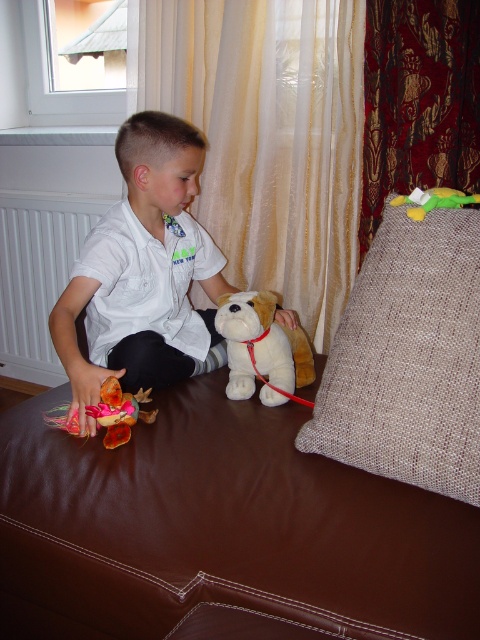
Question: Can you confirm if brown leather couch at center is positioned to the right of green plush toy at upper right?

Choices:
 (A) yes
 (B) no

Answer: (B)

Question: Among these objects, which one is farthest from the camera?

Choices:
 (A) brown leather couch at center
 (B) green plush toy at upper right

Answer: (B)

Question: Does beige textured pillow at upper right appear over white plush dog at center?

Choices:
 (A) no
 (B) yes

Answer: (B)

Question: Which object is positioned closest to the white plush dog at center?

Choices:
 (A) white cotton shirt at center
 (B) brown leather couch at center

Answer: (A)

Question: Considering the relative positions of beige textured pillow at upper right and multicolored fabric doll at lower left in the image provided, where is beige textured pillow at upper right located with respect to multicolored fabric doll at lower left?

Choices:
 (A) above
 (B) below

Answer: (A)

Question: Which point is farther from the camera taking this photo?

Choices:
 (A) (225, 316)
 (B) (327, 400)
 (C) (412, 198)

Answer: (A)